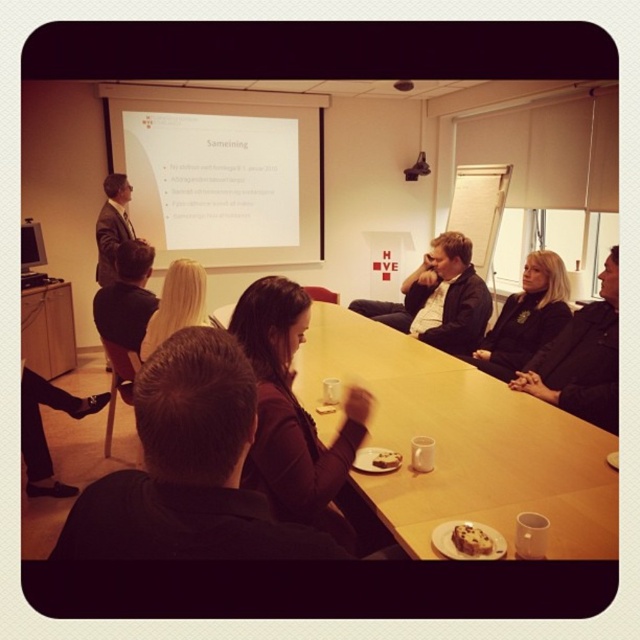
Question: Which object is positioned farthest from the matte wood table at lower left?

Choices:
 (A) white matte projection screen at upper center
 (B) blonde hair at center
 (C) black leather jacket at center

Answer: (C)

Question: Among these points, which one is nearest to the camera?

Choices:
 (A) (291, 97)
 (B) (74, 321)

Answer: (B)

Question: Does black leather jacket at center appear on the left side of matte wood table at lower left?

Choices:
 (A) yes
 (B) no

Answer: (B)

Question: Is wooden table at center above blonde hair at center?

Choices:
 (A) yes
 (B) no

Answer: (B)

Question: Based on their relative distances, which object is nearer to the matte wood table at lower left?

Choices:
 (A) matte brown jacket at center
 (B) white matte projection screen at upper center

Answer: (B)

Question: Does white matte projection screen at upper center appear over black leather jacket at center?

Choices:
 (A) yes
 (B) no

Answer: (A)